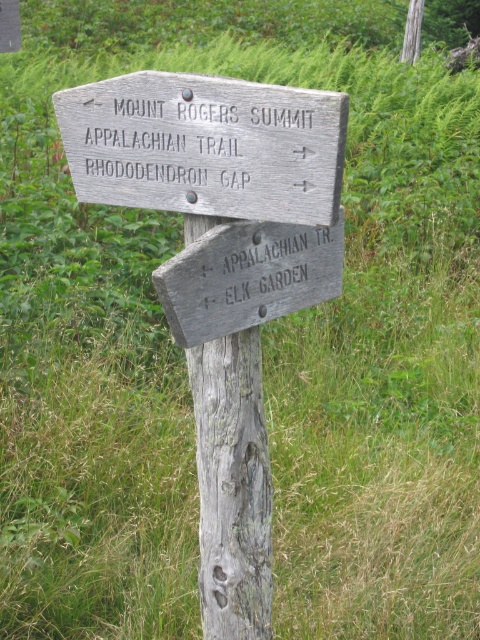
You are a hiker who needs to determine the position of the weathered wood post at center relative to the weathered wood sign at center. Based on the scene, which object is positioned to the left?

The weathered wood post at center is to the left of the weathered wood sign at center.